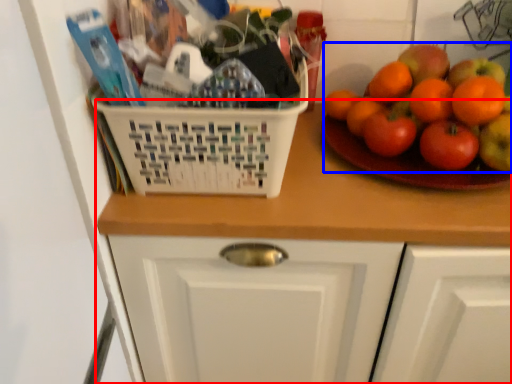
Question: Which of the following is the farthest to the observer, counter (highlighted by a red box) or fruit (highlighted by a blue box)?

Choices:
 (A) counter
 (B) fruit

Answer: (B)